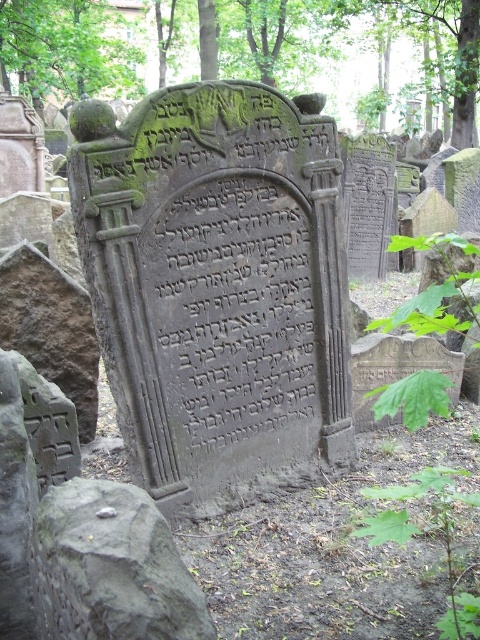
Can you confirm if green mossy tree at upper center is shorter than black stone inscription at center?

Indeed, green mossy tree at upper center has a lesser height compared to black stone inscription at center.

Looking at this image, how distant is green mossy tree at upper center from black stone inscription at center?

green mossy tree at upper center and black stone inscription at center are 10.72 meters apart from each other.

The image size is (480, 640). I want to click on green mossy tree at upper center, so click(256, 51).

Is black stone inscription at center above gray stone at center?

Yes, black stone inscription at center is above gray stone at center.

In the scene shown: Does black stone inscription at center have a larger size compared to gray stone at center?

Indeed, black stone inscription at center has a larger size compared to gray stone at center.

You are a GUI agent. You are given a task and a screenshot of the screen. Output one action in this format:
    pyautogui.click(x=<x>, y=<y>)
    Task: Click on the black stone inscription at center
    Image resolution: width=480 pixels, height=640 pixels.
    Given the screenshot: What is the action you would take?
    pyautogui.click(x=232, y=308)

Which is more to the left, green mossy tree at upper center or gray stone at center?

green mossy tree at upper center is more to the left.

Is green mossy tree at upper center above gray stone at center?

Yes.

Identify the location of green mossy tree at upper center. This screenshot has height=640, width=480. (256, 51).